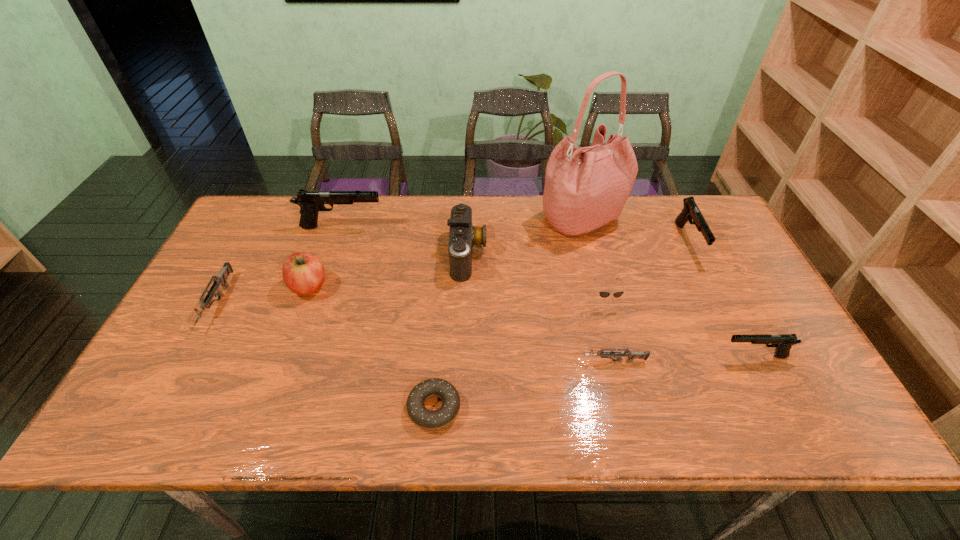
The height and width of the screenshot is (540, 960). What are the coordinates of `free spot between the leftmost gun and the tallest object` in the screenshot? It's located at [x=400, y=261].

This screenshot has width=960, height=540. I want to click on vacant point located between the smallest black gun and the apple, so click(x=532, y=321).

Find the location of a particular element. The width and height of the screenshot is (960, 540). free space between the apple and the shortest object is located at coordinates (372, 347).

Locate an element on the screen. free point between the farther grey gun and the ninth shortest object is located at coordinates (280, 265).

In order to click on vacant area that lies between the nearest object and the apple in this screenshot , I will do `click(372, 347)`.

Find the location of a particular element. The height and width of the screenshot is (540, 960). empty space that is in between the camera and the shortest object is located at coordinates (451, 331).

Locate an element on the screen. The height and width of the screenshot is (540, 960). empty space that is in between the smallest black gun and the camera is located at coordinates (612, 305).

Identify which object is the ninth closest to the camera. Please provide its 2D coordinates. Your answer should be formatted as a tuple, i.e. [(x, y)], where the tuple contains the x and y coordinates of a point satisfying the conditions above.

[(783, 342)]

Image resolution: width=960 pixels, height=540 pixels. Identify the location of object that is the sixth closest to the camera. (603, 353).

At what (x,y) coordinates should I click in order to perform the action: click on gun that is the fifth closest to the apple. Please return your answer as a coordinate pair (x, y). The width and height of the screenshot is (960, 540). Looking at the image, I should click on (690, 211).